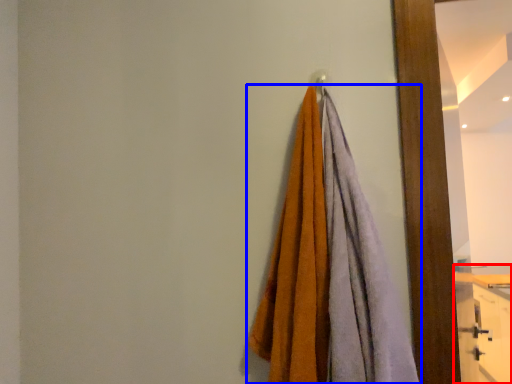
Question: Which of the following is the closest to the observer, dresser (highlighted by a red box) or towel (highlighted by a blue box)?

Choices:
 (A) dresser
 (B) towel

Answer: (B)